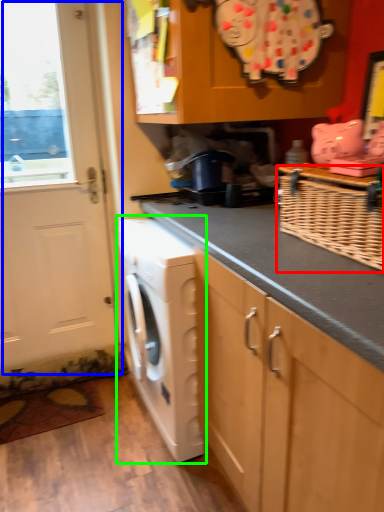
Question: Estimate the real-world distances between objects in this image. Which object is farther from basket (highlighted by a red box), door (highlighted by a blue box) or washing machine (highlighted by a green box)?

Choices:
 (A) door
 (B) washing machine

Answer: (A)